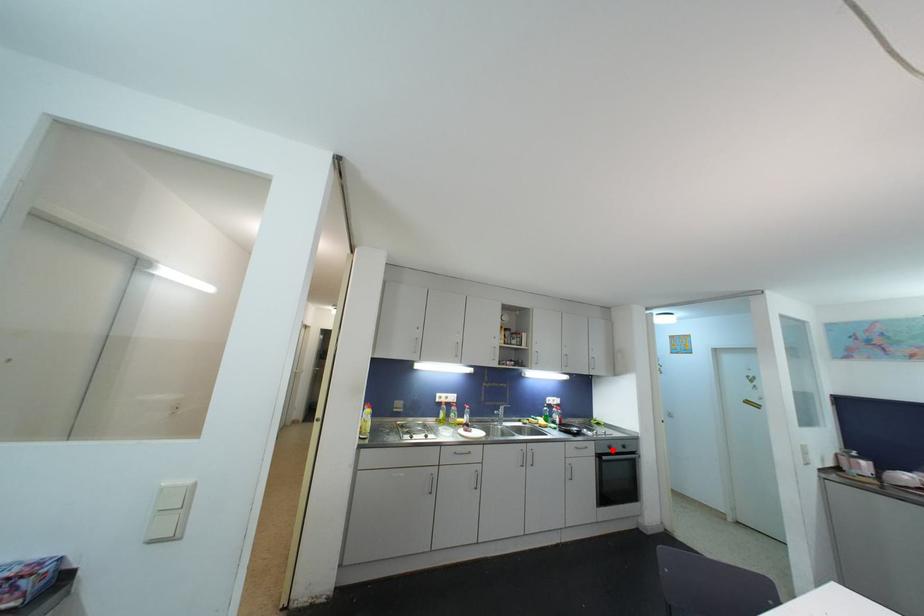
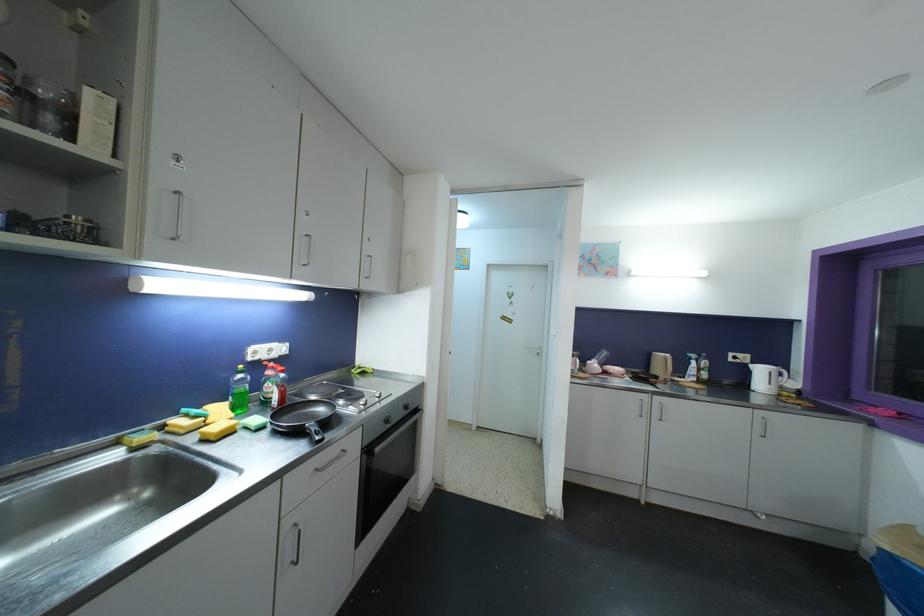
Locate, in the second image, the point that corresponds to the highlighted location in the first image.

(390, 424)